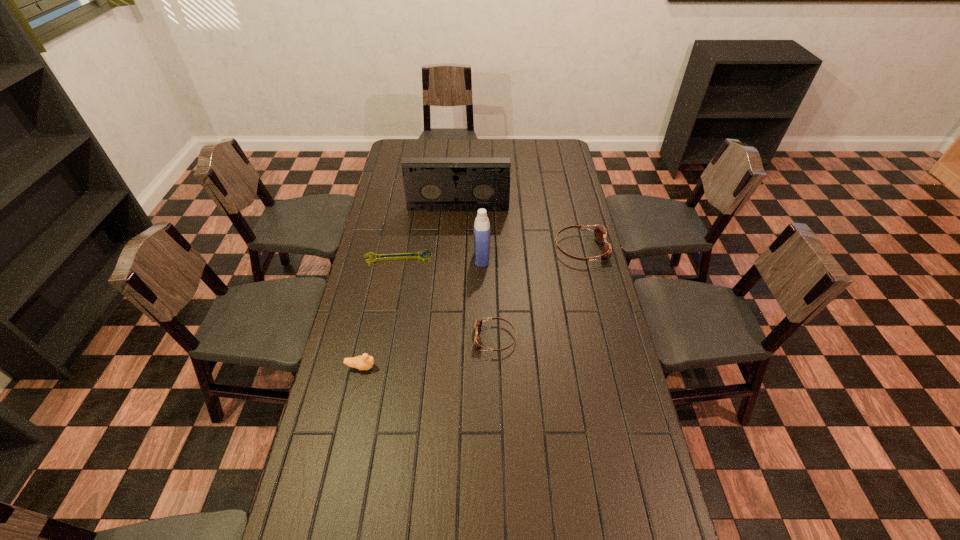
The height and width of the screenshot is (540, 960). Identify the location of vacant space located through the lenses of the second nearest object. (456, 338).

Locate an element on the screen. The width and height of the screenshot is (960, 540). vacant space located on the right of the detergent is located at coordinates (518, 258).

This screenshot has width=960, height=540. I want to click on free space located 0.310m on the front side of the farthest object, so click(455, 261).

Find the location of a particular element. Image resolution: width=960 pixels, height=540 pixels. vacant space situated on the back of the shortest object is located at coordinates (410, 198).

Find the location of a particular element. vacant space located on the face of the duckling is located at coordinates (452, 367).

Identify the location of videotape located at the left edge. The height and width of the screenshot is (540, 960). (431, 184).

Where is `wrench situated at the left edge`? The image size is (960, 540). wrench situated at the left edge is located at coordinates (402, 255).

Locate an element on the screen. duckling that is at the left edge is located at coordinates (365, 362).

Locate an element on the screen. The image size is (960, 540). object that is at the right edge is located at coordinates (600, 234).

At what (x,y) coordinates should I click in order to perform the action: click on free spot at the far edge of the desktop. Please return your answer as a coordinate pair (x, y). The image size is (960, 540). Looking at the image, I should click on (537, 161).